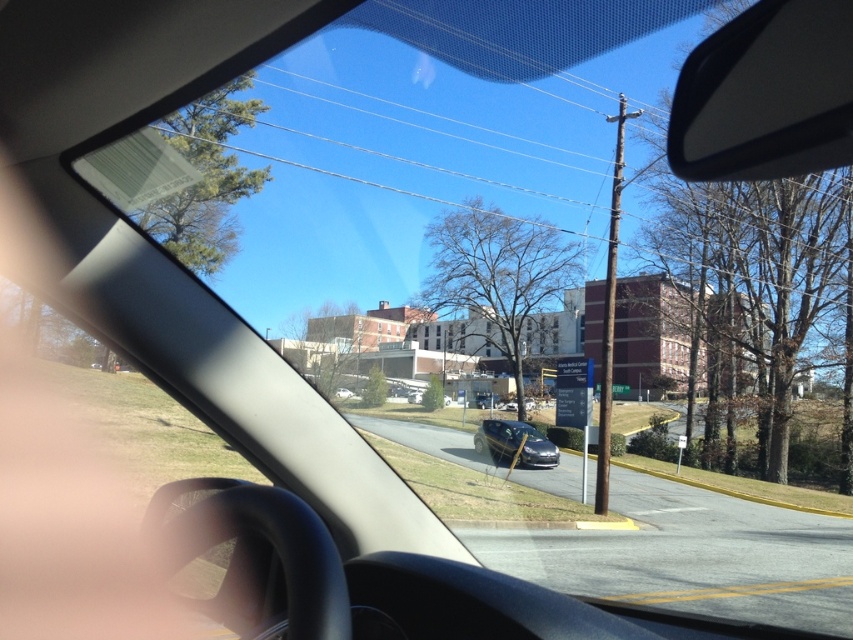
Looking at this image, can you confirm if black plastic view mirror at upper right is positioned below satin black sedan at center?

No.

From the picture: Between black plastic view mirror at upper right and satin black sedan at center, which one is positioned lower?

satin black sedan at center is lower down.

From the picture: Who is more distant from viewer, [674,99] or [538,435]?

Positioned behind is point [538,435].

In order to click on black plastic view mirror at upper right in this screenshot , I will do `click(766, 93)`.